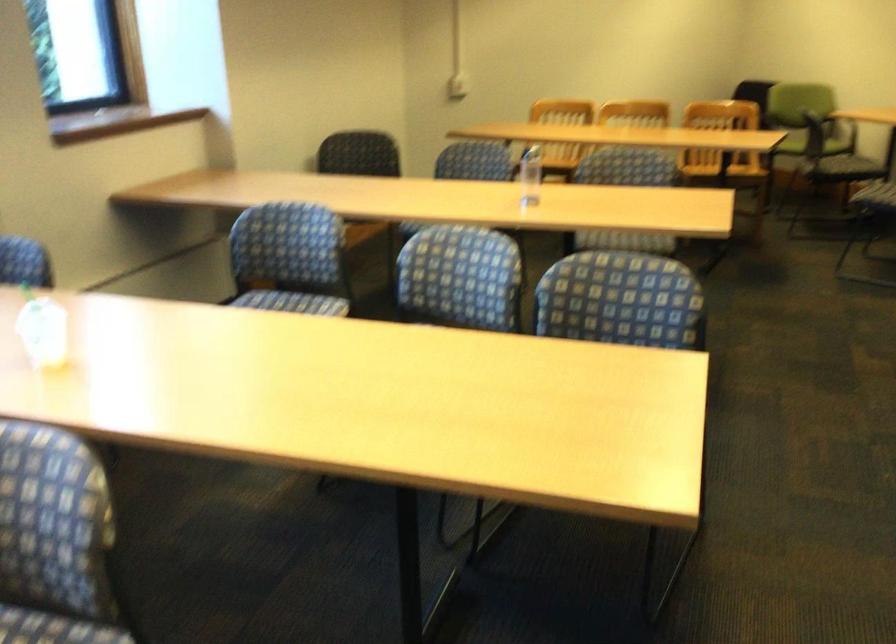
You are a GUI agent. You are given a task and a screenshot of the screen. Output one action in this format:
    pyautogui.click(x=<x>, y=<y>)
    Task: Click on the green chair armrest
    Image resolution: width=896 pixels, height=644 pixels.
    Given the screenshot: What is the action you would take?
    pyautogui.click(x=786, y=100)